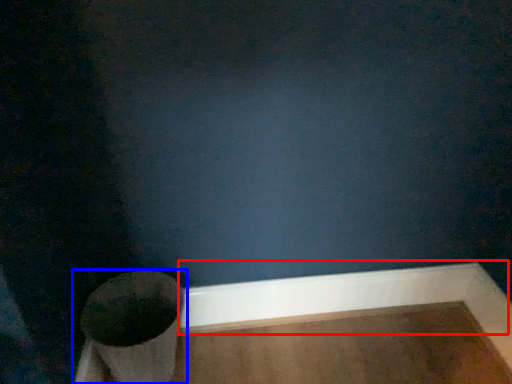
Question: Which object appears closest to the camera in this image, molding (highlighted by a red box) or toilet (highlighted by a blue box)?

Choices:
 (A) molding
 (B) toilet

Answer: (B)